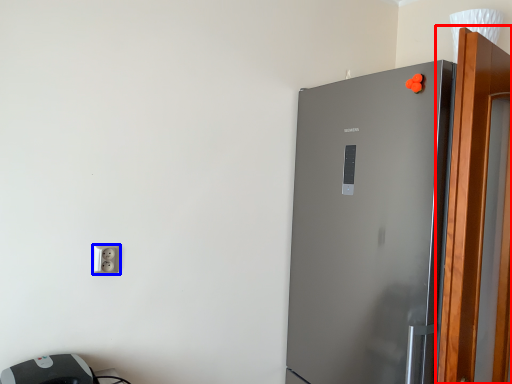
Question: Among these objects, which one is farthest to the camera, screen door (highlighted by a red box) or socket (highlighted by a blue box)?

Choices:
 (A) screen door
 (B) socket

Answer: (B)